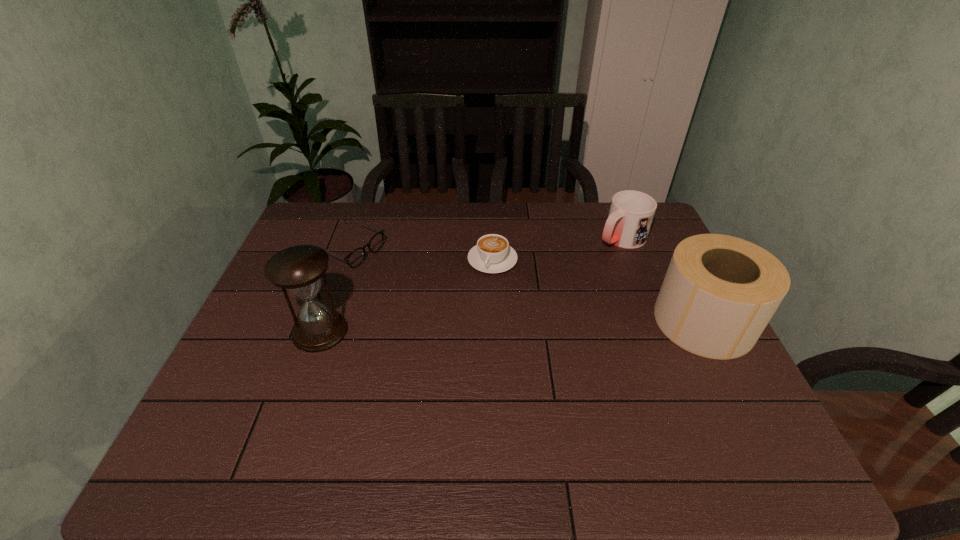
This screenshot has height=540, width=960. Identify the location of vacant point located between the third shortest object and the cappuccino. (557, 249).

Where is `blank region between the mug and the third object from left to right`? This screenshot has height=540, width=960. blank region between the mug and the third object from left to right is located at coordinates (557, 249).

Locate an element on the screen. This screenshot has height=540, width=960. empty space between the cappuccino and the hourglass is located at coordinates (406, 295).

Locate an element on the screen. The width and height of the screenshot is (960, 540). vacant area that lies between the spectacles and the hourglass is located at coordinates (333, 289).

This screenshot has width=960, height=540. I want to click on vacant point located between the third object from left to right and the hourglass, so click(406, 295).

You are a GUI agent. You are given a task and a screenshot of the screen. Output one action in this format:
    pyautogui.click(x=<x>, y=<y>)
    Task: Click on the vacant region between the fourth shortest object and the hourglass
    This screenshot has width=960, height=540.
    Given the screenshot: What is the action you would take?
    pyautogui.click(x=512, y=326)

Find the location of a particular element. free space between the hourglass and the spectacles is located at coordinates (333, 289).

Where is `empty space that is in between the hourglass and the spectacles`? empty space that is in between the hourglass and the spectacles is located at coordinates (333, 289).

I want to click on object that ranks as the fourth closest to the hourglass, so click(x=719, y=293).

Select which object appears as the third closest to the spectacles. Please provide its 2D coordinates. Your answer should be formatted as a tuple, i.e. [(x, y)], where the tuple contains the x and y coordinates of a point satisfying the conditions above.

[(631, 213)]